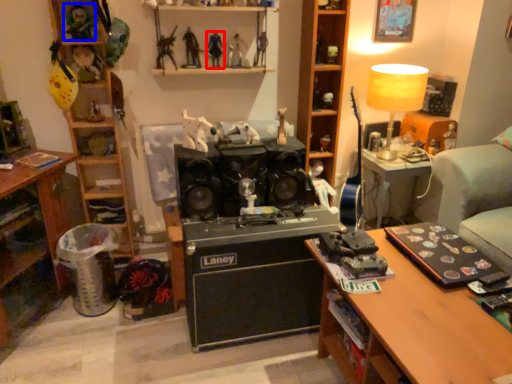
Question: Which object is closer to the camera taking this photo, toy (highlighted by a red box) or toy (highlighted by a blue box)?

Choices:
 (A) toy
 (B) toy

Answer: (B)